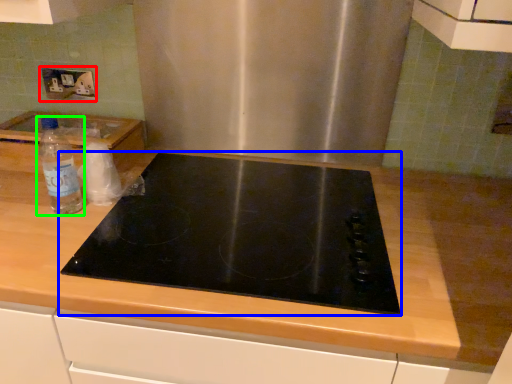
Question: Which object is positioned farthest from electric outlet (highlighted by a red box)? Select from gas stove (highlighted by a blue box) and bottle (highlighted by a green box).

Choices:
 (A) gas stove
 (B) bottle

Answer: (A)